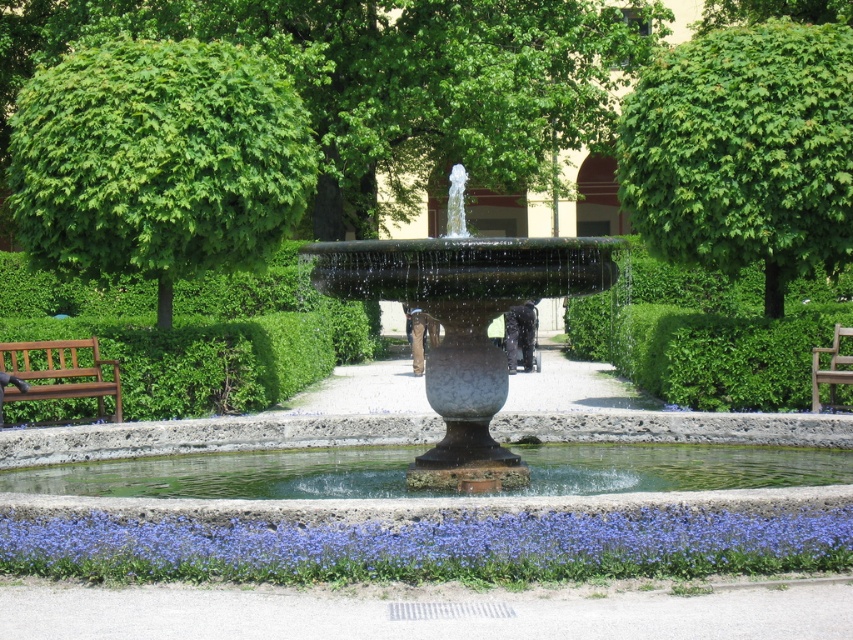
Question: Which of these objects is positioned closest to the clear glass water at center?

Choices:
 (A) green leafy tree at upper center
 (B) wooden bench at center

Answer: (B)

Question: From the image, what is the correct spatial relationship of green leafy tree at upper left in relation to blue matte flower at lower center?

Choices:
 (A) above
 (B) below

Answer: (A)

Question: Which is nearer to the green leafy tree at upper left?

Choices:
 (A) green leafy tree at upper center
 (B) wooden bench at center

Answer: (A)

Question: Observing the image, what is the correct spatial positioning of green leafy tree at upper center in reference to smooth stone fountain at center?

Choices:
 (A) right
 (B) left

Answer: (A)

Question: Where is brown wooden bench at left located in relation to wooden bench at center in the image?

Choices:
 (A) left
 (B) right

Answer: (A)

Question: Which object is closer to the camera taking this photo?

Choices:
 (A) green leafy tree at upper left
 (B) smooth stone fountain at center
 (C) wooden bench at center

Answer: (B)